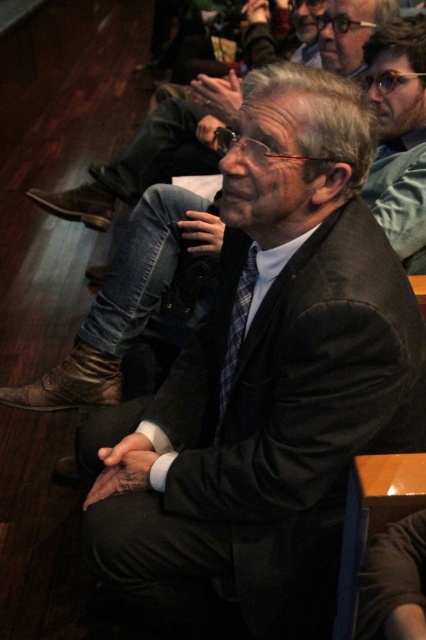
Question: Which of the following is the farthest from the observer?

Choices:
 (A) matte black suit at upper center
 (B) plaid fabric tie at center
 (C) black woolen suit at center
 (D) black wool suit at center

Answer: (A)

Question: Which of the following is the closest to the observer?

Choices:
 (A) (330, 4)
 (B) (244, 296)

Answer: (B)

Question: Does black woolen suit at center have a greater width compared to black wool suit at center?

Choices:
 (A) yes
 (B) no

Answer: (A)

Question: Among these points, which one is nearest to the camera?

Choices:
 (A) (382, 19)
 (B) (382, 170)
 (C) (92, 460)

Answer: (C)

Question: Can you confirm if black woolen suit at center is positioned below matte black suit at upper center?

Choices:
 (A) no
 (B) yes

Answer: (B)

Question: Does black wool suit at center appear under matte black suit at upper center?

Choices:
 (A) yes
 (B) no

Answer: (A)